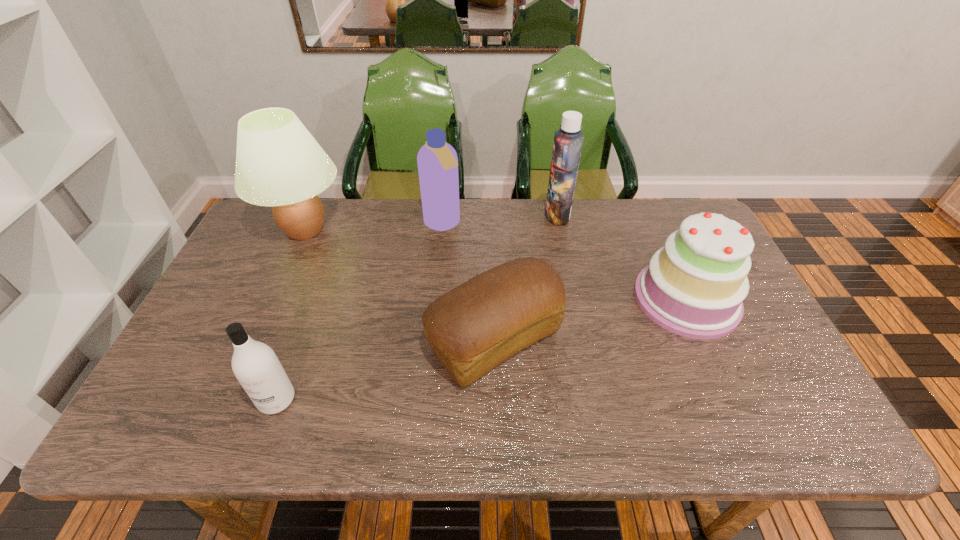
I want to click on lampshade, so click(279, 163).

This screenshot has height=540, width=960. I want to click on the rightmost shampoo, so click(568, 140).

Identify the location of the second shampoo from left to right. [x=437, y=161].

I want to click on the shortest shampoo, so click(x=255, y=365).

Where is `the nearest shampoo`? This screenshot has width=960, height=540. the nearest shampoo is located at coordinates (255, 365).

Identify the location of the rightmost object. (694, 286).

At what (x,y) coordinates should I click in order to perform the action: click on bread. Please return your answer as a coordinate pair (x, y). This screenshot has height=540, width=960. Looking at the image, I should click on (473, 328).

I want to click on blank space located 0.370m on the shade of the lampshade, so click(463, 230).

Locate an element on the screen. The height and width of the screenshot is (540, 960). vacant space situated 0.160m on the front label of the rightmost shampoo is located at coordinates (498, 214).

Image resolution: width=960 pixels, height=540 pixels. I want to click on free point located 0.220m on the front label of the rightmost shampoo, so click(480, 214).